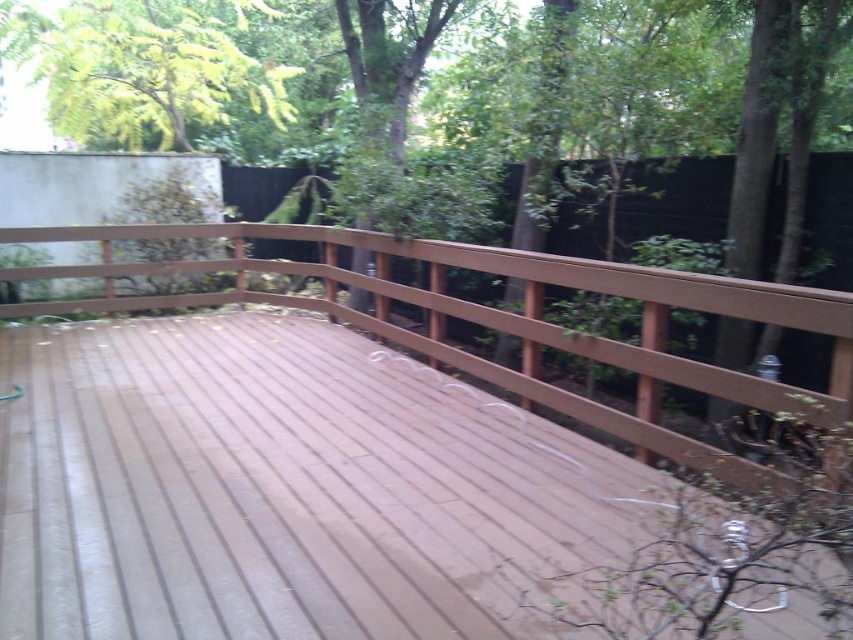
Question: Does yellow-green leaves at upper left have a larger size compared to brown wooden deck at center?

Choices:
 (A) no
 (B) yes

Answer: (B)

Question: Is satin wood deck at center to the right of yellow-green leaves at upper left from the viewer's perspective?

Choices:
 (A) no
 (B) yes

Answer: (B)

Question: Which point appears closest to the camera in this image?

Choices:
 (A) (15, 241)
 (B) (346, 461)
 (C) (216, 36)

Answer: (B)

Question: Which point appears farthest from the camera in this image?

Choices:
 (A) pyautogui.click(x=364, y=278)
 (B) pyautogui.click(x=344, y=556)
 (C) pyautogui.click(x=199, y=44)

Answer: (C)

Question: Which point appears farthest from the camera in this image?

Choices:
 (A) (310, 481)
 (B) (190, 36)

Answer: (B)

Question: Is satin wood deck at center wider than yellow-green leaves at upper left?

Choices:
 (A) no
 (B) yes

Answer: (A)